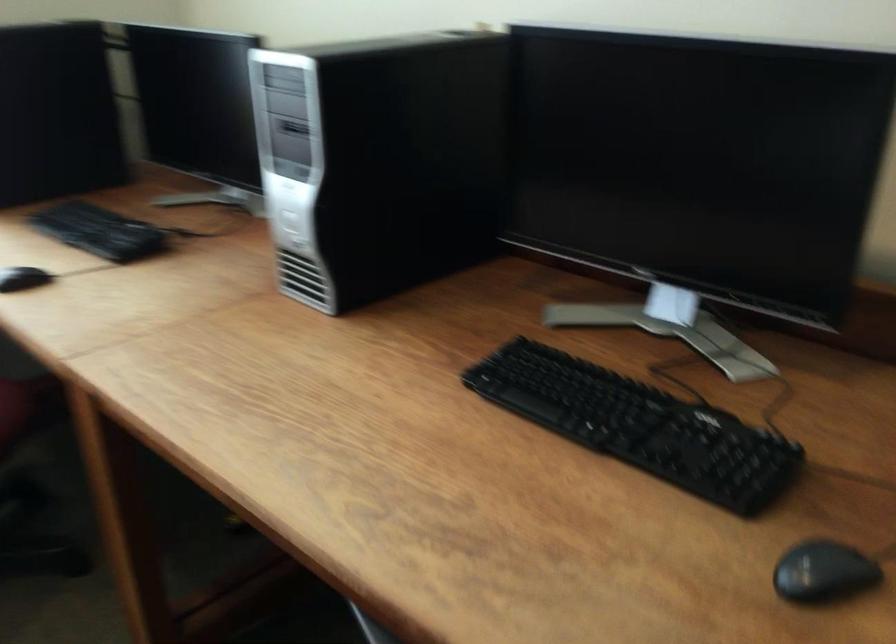
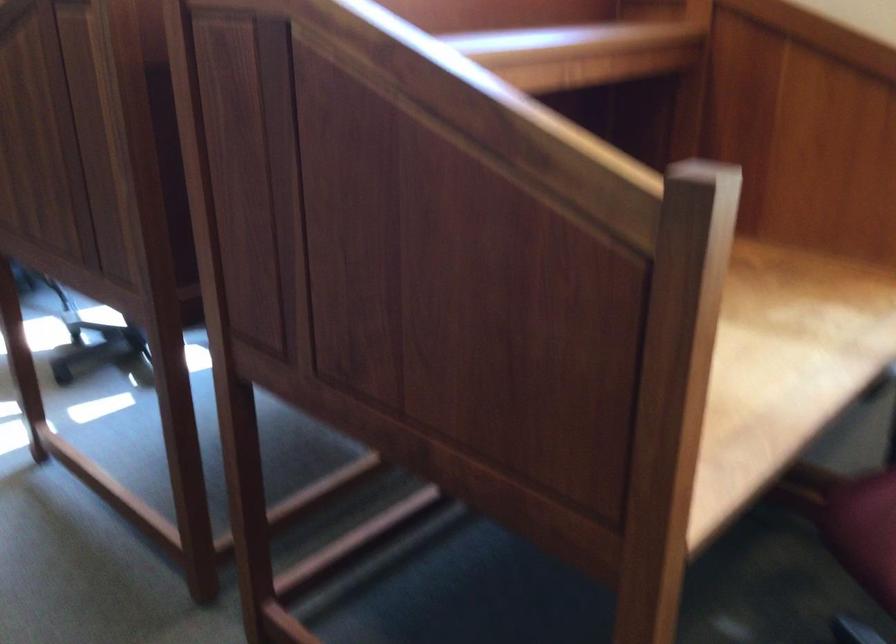
The images are taken continuously from a first-person perspective. In which direction is your viewpoint rotating?

The rotation direction of the camera is left-down.